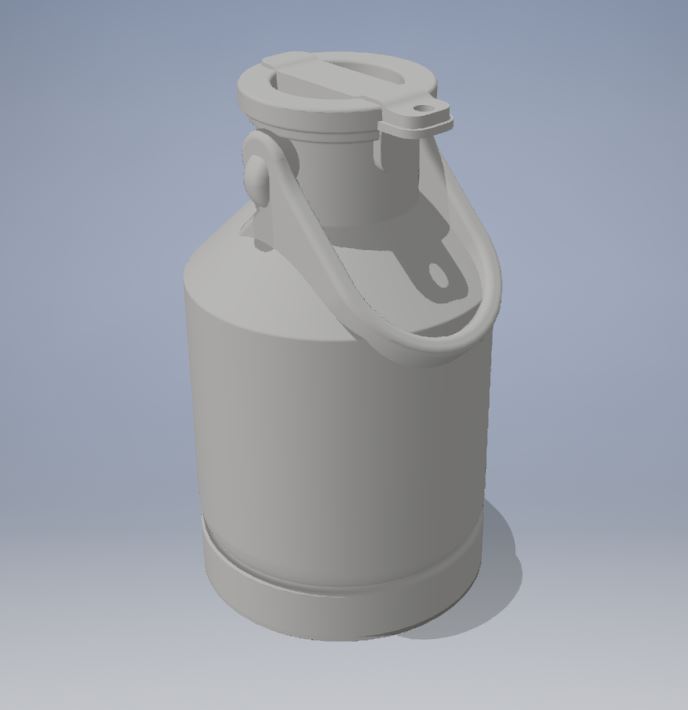
You are a GUI agent. You are given a task and a screenshot of the screen. Output one action in this format:
    pyautogui.click(x=<x>, y=<y>)
    Task: Click on the handle
    
    Given the screenshot: What is the action you would take?
    pyautogui.click(x=439, y=348)